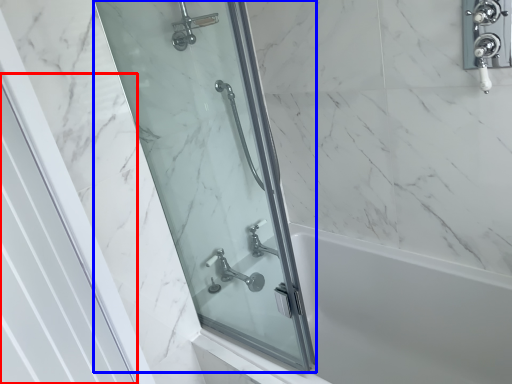
Question: Which object is further to the camera taking this photo, screen door (highlighted by a red box) or screen door (highlighted by a blue box)?

Choices:
 (A) screen door
 (B) screen door

Answer: (B)